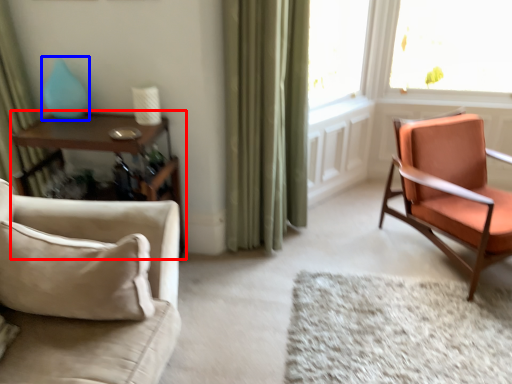
Question: Which object appears closest to the camera in this image, table (highlighted by a red box) or turquoise (highlighted by a blue box)?

Choices:
 (A) table
 (B) turquoise

Answer: (A)